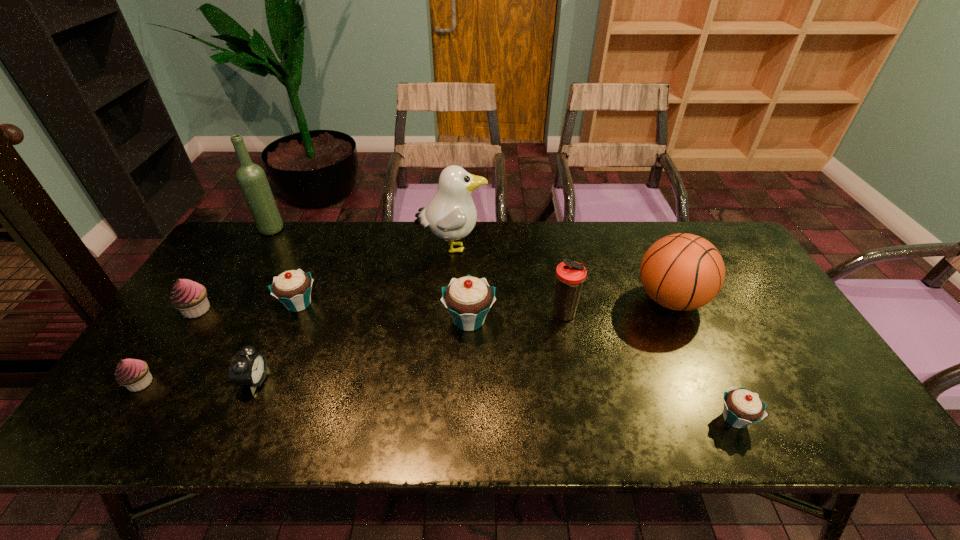
Identify the location of the bigger pink cupcake. (190, 298).

In order to click on alarm clock in this screenshot , I will do `click(248, 368)`.

Find the location of a particular element. the smaller pink cupcake is located at coordinates (134, 374).

Where is `the nearer pink cupcake`? This screenshot has height=540, width=960. the nearer pink cupcake is located at coordinates (134, 374).

In order to click on the smallest teal cupcake in this screenshot , I will do tap(741, 407).

Where is `the nearest object`? The height and width of the screenshot is (540, 960). the nearest object is located at coordinates (741, 407).

Identify the location of free space located 0.390m on the front of the wine bottle. The image size is (960, 540). (216, 323).

Find the location of a particular element. The width and height of the screenshot is (960, 540). vacant area situated on the beak of the white gull is located at coordinates (512, 247).

The image size is (960, 540). What are the coordinates of `vacant space located 0.300m on the left of the basketball` in the screenshot? It's located at (529, 300).

Identify the location of free space located 0.290m on the right of the brown thermos bottle. (684, 315).